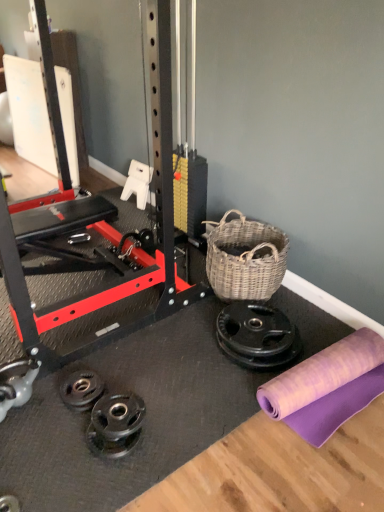
Question: Is woven natural basket at center-right in front of or behind black rubber weight plate at lower left in the image?

Choices:
 (A) front
 (B) behind

Answer: (B)

Question: From a real-world perspective, is woven natural basket at center-right positioned above or below black rubber weight plate at lower left?

Choices:
 (A) below
 (B) above

Answer: (B)

Question: Based on their relative distances, which object is nearer to the purple fabric at lower right?

Choices:
 (A) woven natural basket at center-right
 (B) black rubber weight plate at lower left

Answer: (A)

Question: Which object is positioned closest to the purple fabric at lower right?

Choices:
 (A) black rubber weight plate at lower left
 (B) woven natural basket at center-right

Answer: (B)